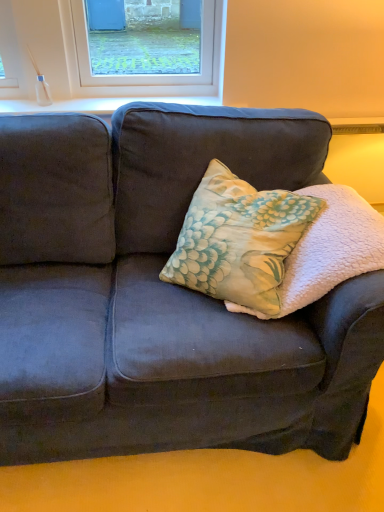
Question: Is floral fabric pillow at center facing towards floral fabric pillow at center?

Choices:
 (A) yes
 (B) no

Answer: (A)

Question: Considering the relative sizes of floral fabric pillow at center and floral fabric pillow at center in the image provided, is floral fabric pillow at center shorter than floral fabric pillow at center?

Choices:
 (A) yes
 (B) no

Answer: (A)

Question: Can you see floral fabric pillow at center touching floral fabric pillow at center?

Choices:
 (A) yes
 (B) no

Answer: (B)

Question: Is floral fabric pillow at center smaller than floral fabric pillow at center?

Choices:
 (A) yes
 (B) no

Answer: (A)

Question: Is floral fabric pillow at center not close to floral fabric pillow at center?

Choices:
 (A) no
 (B) yes

Answer: (A)

Question: From a real-world perspective, is floral fabric pillow at center positioned over floral fabric pillow at center based on gravity?

Choices:
 (A) yes
 (B) no

Answer: (A)

Question: From a real-world perspective, is velvet dark blue couch at center under floral fabric pillow at center?

Choices:
 (A) yes
 (B) no

Answer: (A)

Question: Is there a large distance between velvet dark blue couch at center and floral fabric pillow at center?

Choices:
 (A) yes
 (B) no

Answer: (B)

Question: Can you confirm if velvet dark blue couch at center is shorter than floral fabric pillow at center?

Choices:
 (A) no
 (B) yes

Answer: (B)

Question: Is velvet dark blue couch at center to the right of floral fabric pillow at center from the viewer's perspective?

Choices:
 (A) no
 (B) yes

Answer: (A)

Question: From a real-world perspective, is velvet dark blue couch at center over floral fabric pillow at center?

Choices:
 (A) yes
 (B) no

Answer: (B)

Question: Is velvet dark blue couch at center positioned in front of floral fabric pillow at center?

Choices:
 (A) no
 (B) yes

Answer: (A)

Question: Is white smooth window sill at upper center surrounded by floral fabric pillow at center?

Choices:
 (A) yes
 (B) no

Answer: (B)